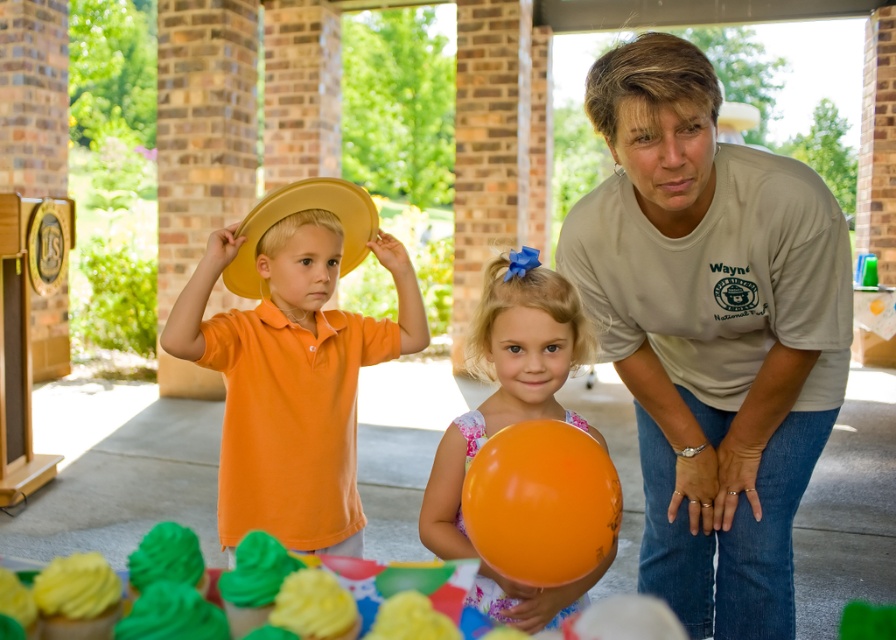
Between matte yellow hat at center and orange glossy balloon at lower center, which one is positioned lower?

orange glossy balloon at lower center is lower down.

Find the location of a particular element. This screenshot has height=640, width=896. matte yellow hat at center is located at coordinates (293, 358).

Which is in front, point (259, 243) or point (509, 557)?

Point (509, 557)

At what (x,y) coordinates should I click in order to perform the action: click on matte yellow hat at center. Please return your answer as a coordinate pair (x, y). Looking at the image, I should click on (293, 358).

Between point (584, 330) and point (194, 557), which one is positioned behind?

Positioned behind is point (584, 330).

Is point (455, 444) positioned before point (154, 545)?

No, it is not.

Locate an element on the screen. This screenshot has width=896, height=640. orange glossy balloon at center is located at coordinates (507, 380).

Is point (242, 228) less distant than point (90, 600)?

No, (242, 228) is behind (90, 600).

Where is `yellow straw hat at center`? This screenshot has height=640, width=896. yellow straw hat at center is located at coordinates (300, 211).

Between point (230, 260) and point (106, 608), which one is positioned in front?

Point (106, 608)

Locate an element on the screen. yellow straw hat at center is located at coordinates (300, 211).